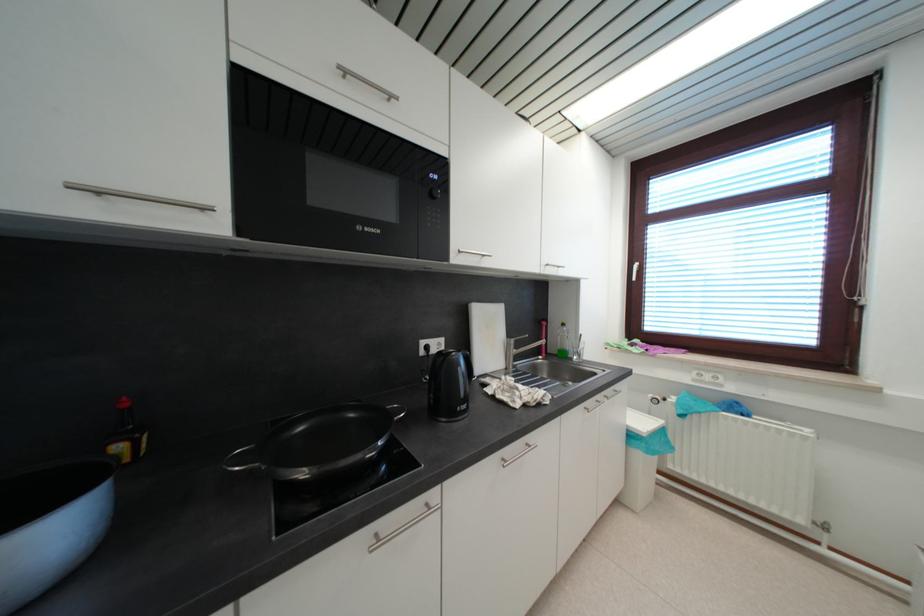
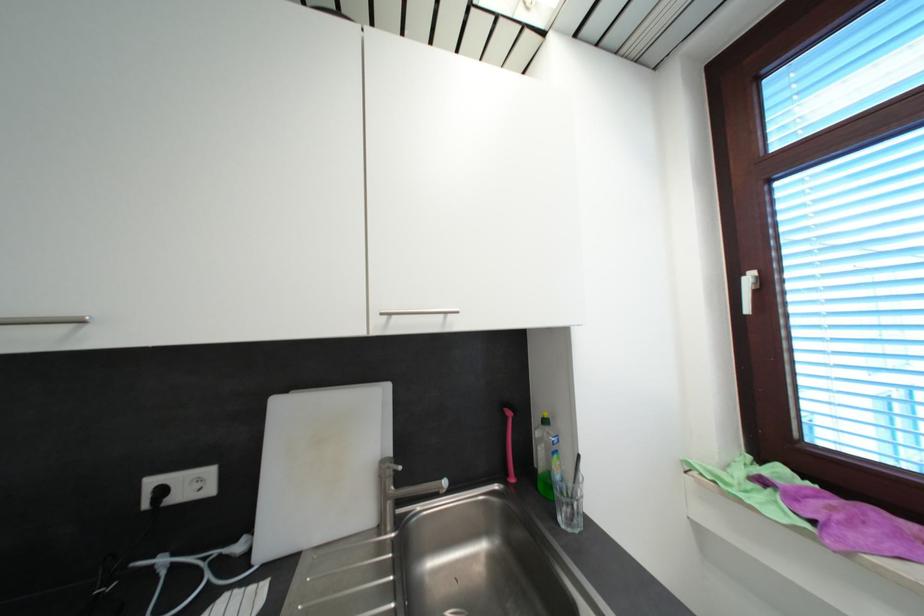
Locate, in the second image, the point that corresponds to (640,268) in the first image.

(754, 281)